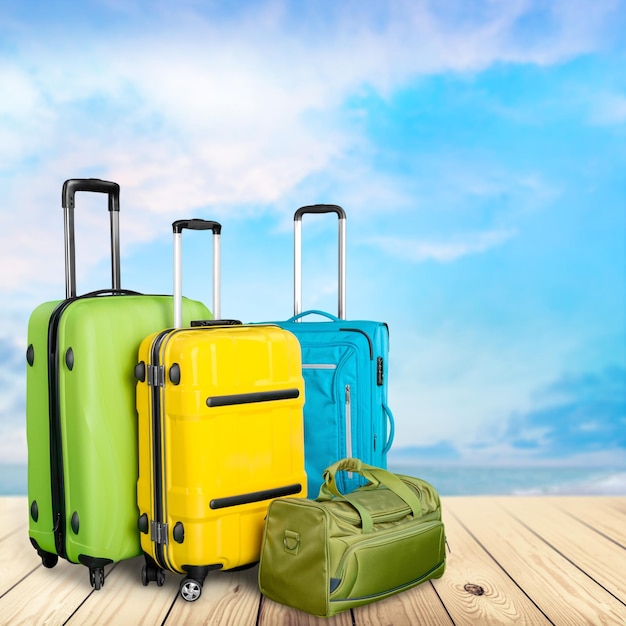
The image size is (626, 626). Identify the location of hinges. (165, 535), (150, 533), (160, 376), (148, 379).